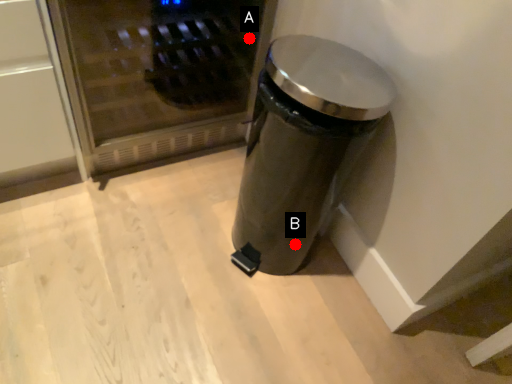
Question: Two points are circled on the image, labeled by A and B beside each circle. Among these points, which one is farthest from the camera?

Choices:
 (A) A is further
 (B) B is further

Answer: (B)